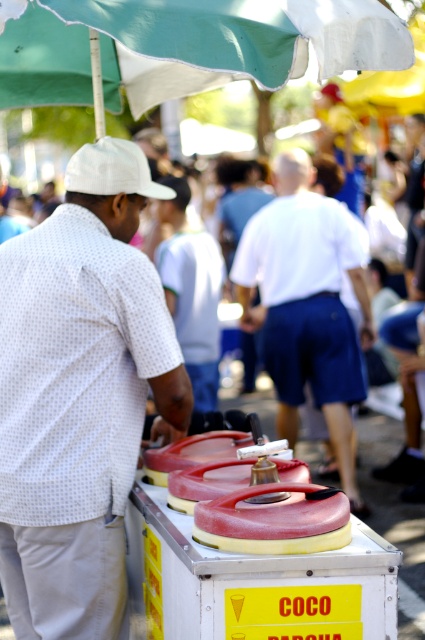
You are a customer at the market and want to buy an ice cream from the vendor. You notice two white items near the vendor. Which item is closer to you, the white cotton shirt at center or the white matte baseball cap at left?

The white cotton shirt at center is closer to you because the white matte baseball cap at left is behind it, meaning the shirt is in front.

You are a customer waiting in line at the ice cream cart. You notice a white dotted shirt at left and a green fabric umbrella at upper center. Which object is closer to the ice cream cart?

The white dotted shirt at left is closer to the ice cream cart because it is positioned under the green fabric umbrella at upper center, indicating it is lower in the scene and thus nearer to the cart located in the foreground.